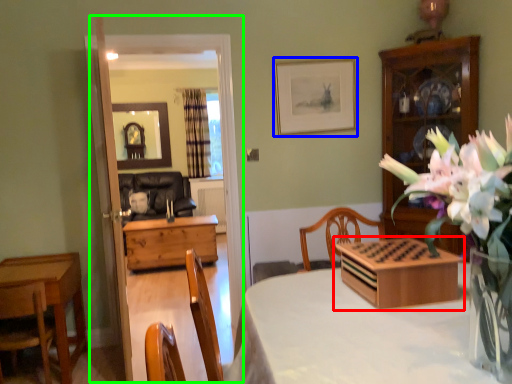
Question: Considering the real-world distances, which object is closest to tableware (highlighted by a red box)? picture frame (highlighted by a blue box) or glass door (highlighted by a green box).

Choices:
 (A) picture frame
 (B) glass door

Answer: (B)